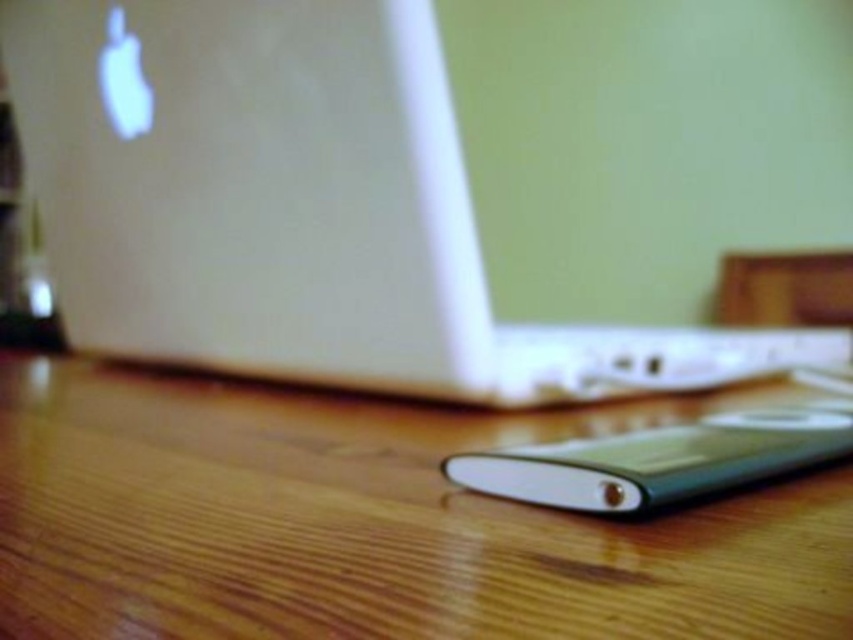
Is point (218, 26) positioned before point (25, 452)?

That is False.

From the picture: Who is taller, white glossy laptop at center or wooden table at lower center?

white glossy laptop at center

You are a GUI agent. You are given a task and a screenshot of the screen. Output one action in this format:
    pyautogui.click(x=<x>, y=<y>)
    Task: Click on the white glossy laptop at center
    The image size is (853, 640).
    Given the screenshot: What is the action you would take?
    pyautogui.click(x=437, y=184)